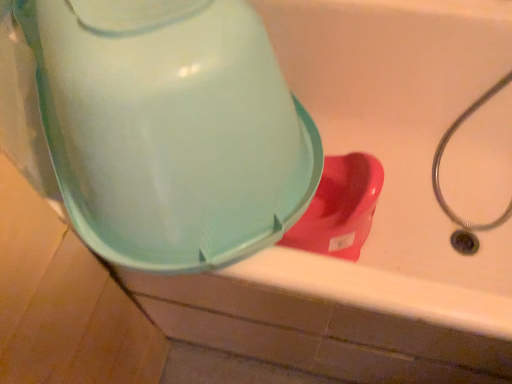
Question: Is matte plastic water cooler at upper left at the left side of rubberized plastic toilet at lower right?

Choices:
 (A) no
 (B) yes

Answer: (B)

Question: From a real-world perspective, is matte plastic water cooler at upper left located beneath rubberized plastic toilet at lower right?

Choices:
 (A) yes
 (B) no

Answer: (B)

Question: Does matte plastic water cooler at upper left have a larger size compared to rubberized plastic toilet at lower right?

Choices:
 (A) no
 (B) yes

Answer: (B)

Question: Does matte plastic water cooler at upper left appear on the right side of rubberized plastic toilet at lower right?

Choices:
 (A) yes
 (B) no

Answer: (B)

Question: Is matte plastic water cooler at upper left taller than rubberized plastic toilet at lower right?

Choices:
 (A) no
 (B) yes

Answer: (B)

Question: Does matte plastic water cooler at upper left have a smaller size compared to rubberized plastic toilet at lower right?

Choices:
 (A) yes
 (B) no

Answer: (B)

Question: Does rubberized plastic toilet at lower right appear on the left side of matte plastic water cooler at upper left?

Choices:
 (A) yes
 (B) no

Answer: (B)

Question: Is rubberized plastic toilet at lower right not close to matte plastic water cooler at upper left?

Choices:
 (A) yes
 (B) no

Answer: (B)

Question: Can you confirm if rubberized plastic toilet at lower right is thinner than matte plastic water cooler at upper left?

Choices:
 (A) yes
 (B) no

Answer: (A)

Question: From the image's perspective, is rubberized plastic toilet at lower right located beneath matte plastic water cooler at upper left?

Choices:
 (A) yes
 (B) no

Answer: (A)

Question: Is rubberized plastic toilet at lower right aimed at matte plastic water cooler at upper left?

Choices:
 (A) no
 (B) yes

Answer: (A)

Question: Is rubberized plastic toilet at lower right directly adjacent to matte plastic water cooler at upper left?

Choices:
 (A) yes
 (B) no

Answer: (B)

Question: From the image's perspective, is matte plastic water cooler at upper left above or below rubberized plastic toilet at lower right?

Choices:
 (A) below
 (B) above

Answer: (B)